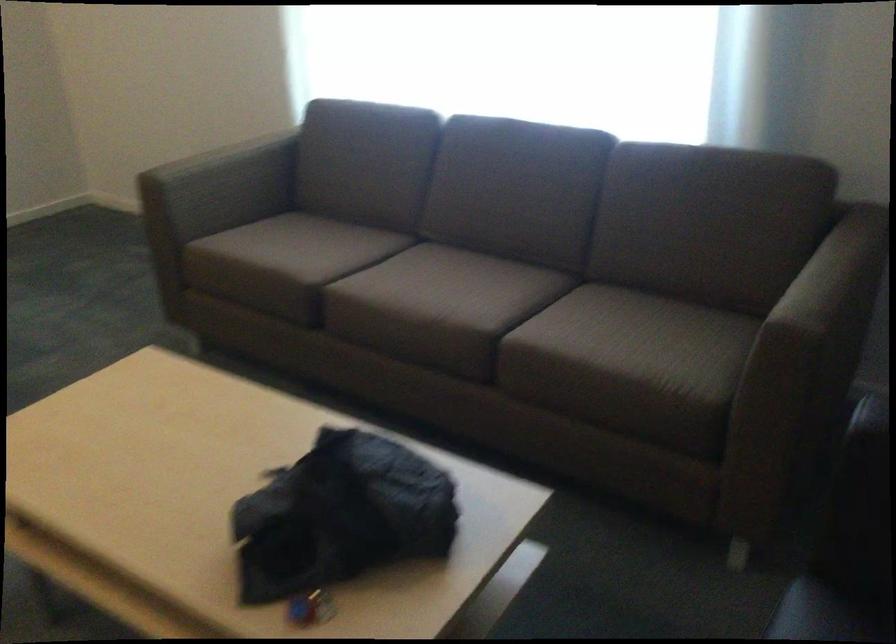
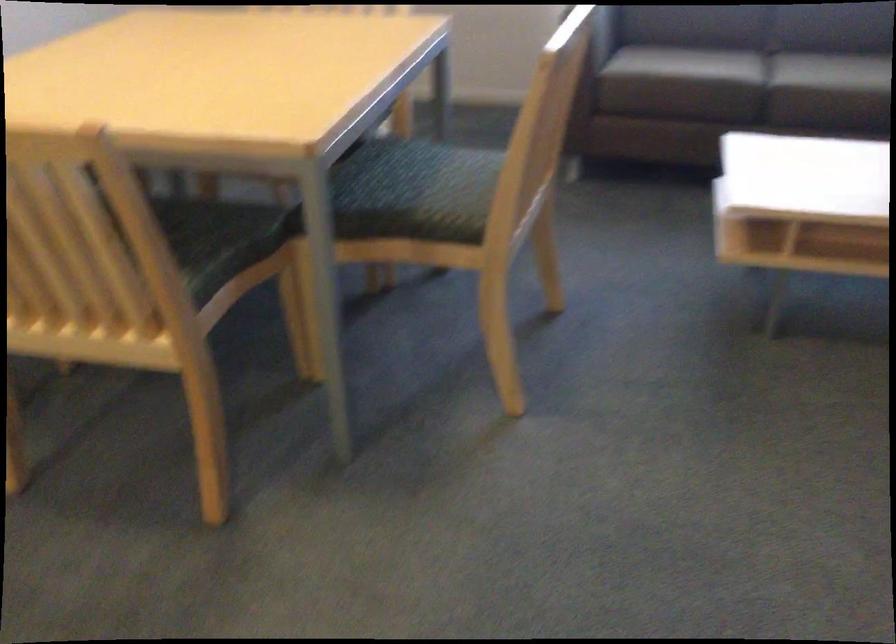
Question: In a continuous first-person perspective shot, in which direction is the camera moving?

Choices:
 (A) Left
 (B) Right
 (C) Forward
 (D) Backward

Answer: (A)